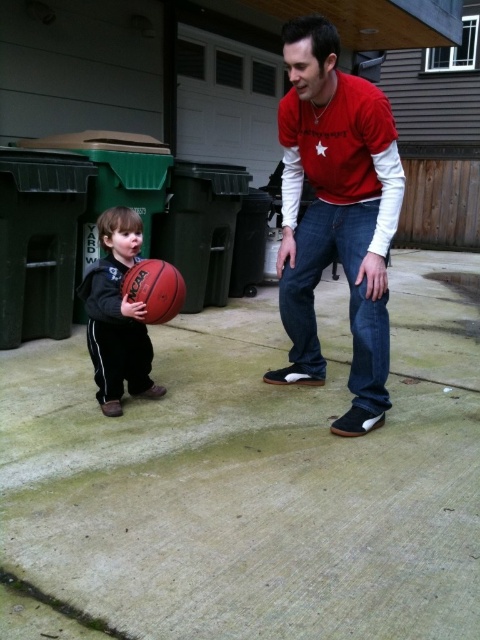
Question: Does red cotton shirt at center lie in front of rubber basketball at left?

Choices:
 (A) yes
 (B) no

Answer: (A)

Question: Does red cotton shirt at center have a greater width compared to rubber basketball at left?

Choices:
 (A) no
 (B) yes

Answer: (B)

Question: Which object is farther from the camera taking this photo?

Choices:
 (A) rubber basketball at left
 (B) red cotton shirt at center

Answer: (A)

Question: Which point appears farthest from the camera in this image?

Choices:
 (A) (175, 294)
 (B) (99, 400)

Answer: (B)

Question: Among these objects, which one is nearest to the camera?

Choices:
 (A) rubber basketball at left
 (B) red cotton shirt at center
 (C) rubber basketball at center

Answer: (B)

Question: Is the position of rubber basketball at left less distant than that of rubber basketball at center?

Choices:
 (A) no
 (B) yes

Answer: (B)